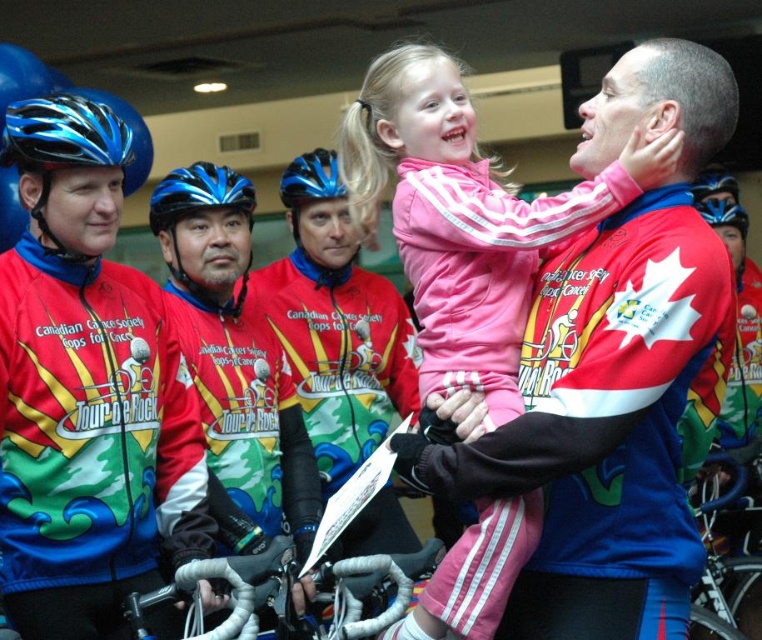
You are a photographer setting up for a group photo in this scene. You need to ensure that the pink fleece jacket at center and the blue matte bicycle helmet at upper left are both visible in the frame. Considering their sizes, which object might require you to adjust your camera angle to include it properly?

The pink fleece jacket at center has a greater height compared to the blue matte bicycle helmet at upper left, so it might require adjusting the camera angle to ensure it is fully visible in the frame.

You are a photographer positioned at the back of the room. You need to take a photo that includes both the red and white jersey at left and the blue matte bicycle helmet at center. Based on their positions, which object should appear lower in the photo?

The red and white jersey at left should appear lower in the photo because it is located below the blue matte bicycle helmet at center.